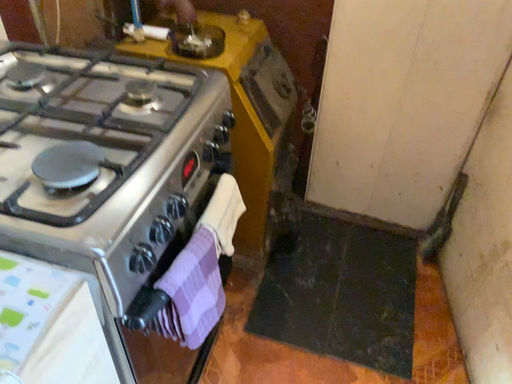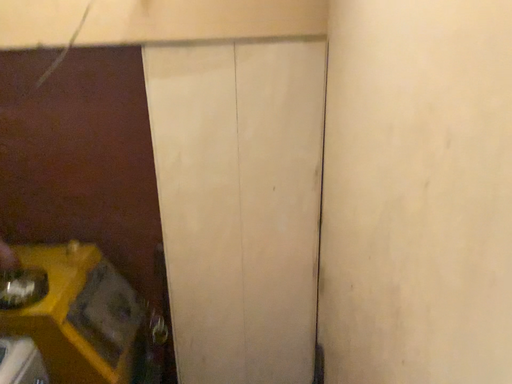
Question: How did the camera likely rotate when shooting the video?

Choices:
 (A) rotated right
 (B) rotated left

Answer: (A)